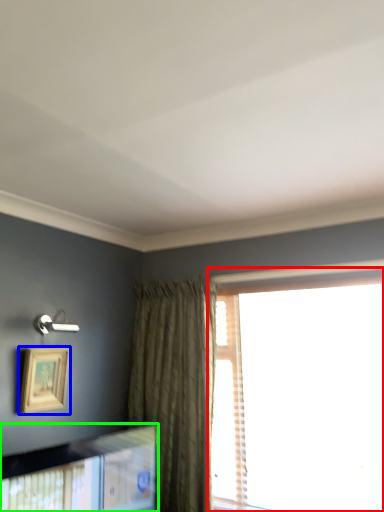
Question: Estimate the real-world distances between objects in this image. Which object is farther from window (highlighted by a red box), picture frame (highlighted by a blue box) or picture frame (highlighted by a green box)?

Choices:
 (A) picture frame
 (B) picture frame

Answer: (A)